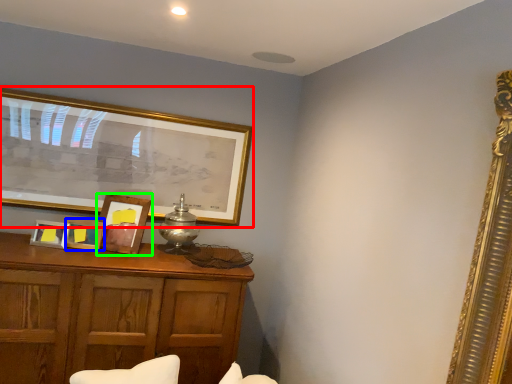
Question: Based on their relative distances, which object is nearer to picture frame (highlighted by a red box)? Choose from picture frame (highlighted by a blue box) and picture frame (highlighted by a green box).

Choices:
 (A) picture frame
 (B) picture frame

Answer: (B)